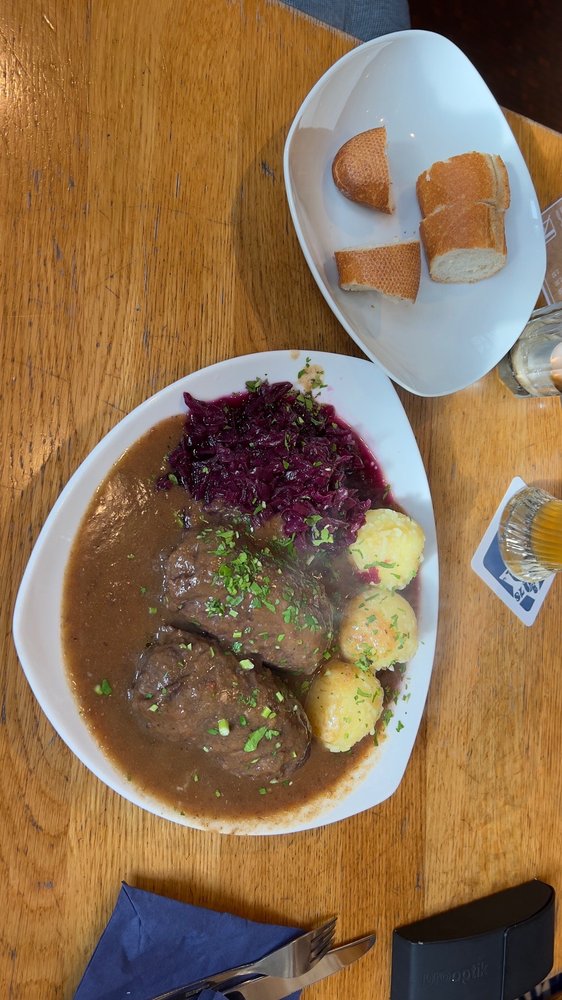
Locate an element on the screen. The height and width of the screenshot is (1000, 562). grainy golden wood table is located at coordinates (156, 238).